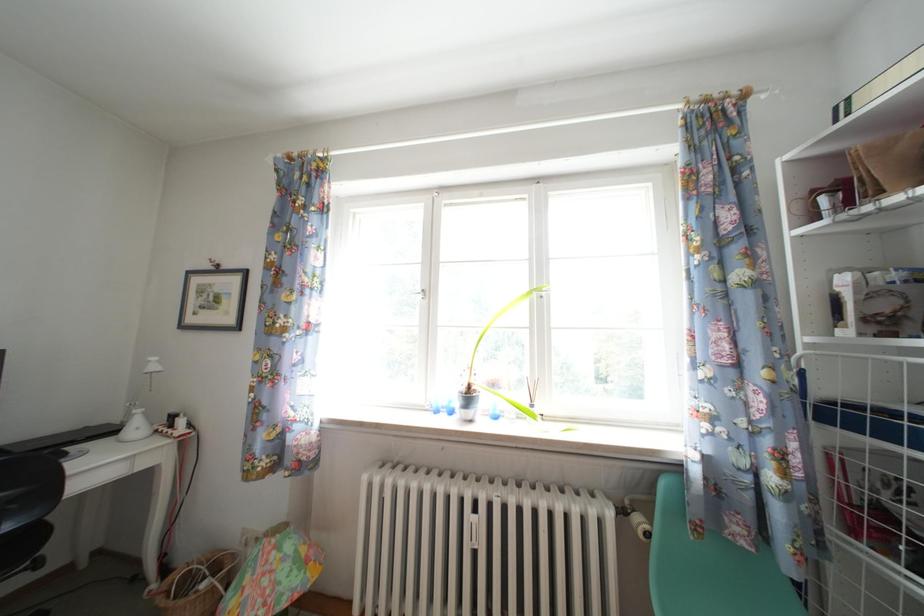
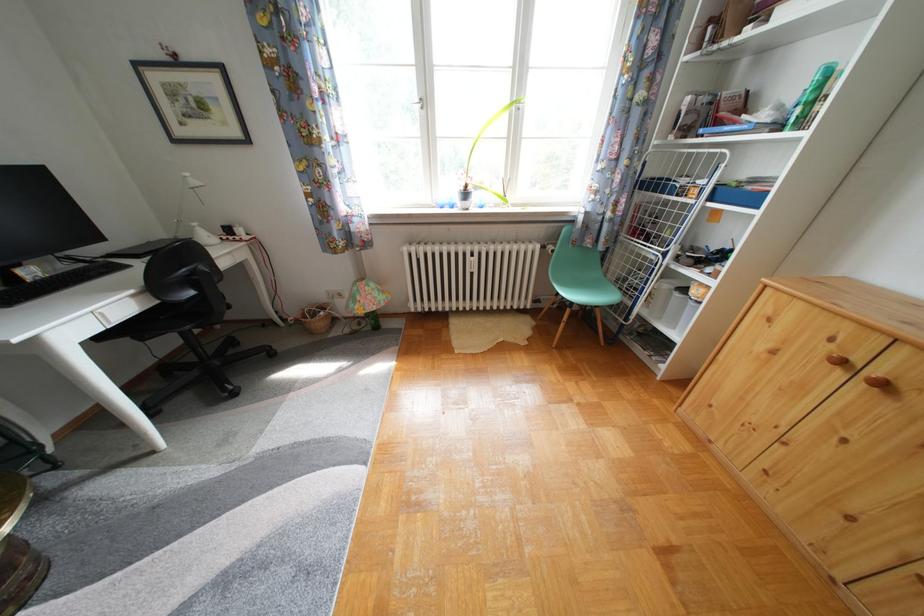
Question: The first image is from the beginning of the video and the second image is from the end. How did the camera likely rotate when shooting the video?

Choices:
 (A) Left
 (B) Right
 (C) Up
 (D) Down

Answer: (D)